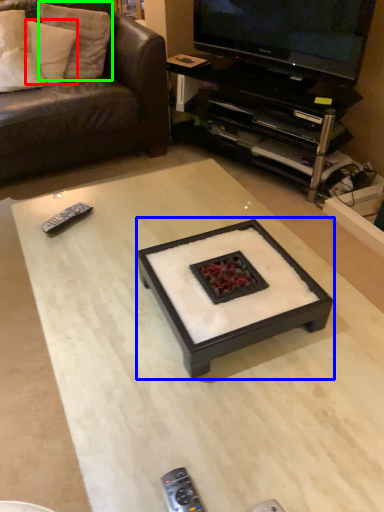
Question: Which is farther away from pillow (highlighted by a red box)? coffee table (highlighted by a blue box) or pillow (highlighted by a green box)?

Choices:
 (A) coffee table
 (B) pillow

Answer: (A)